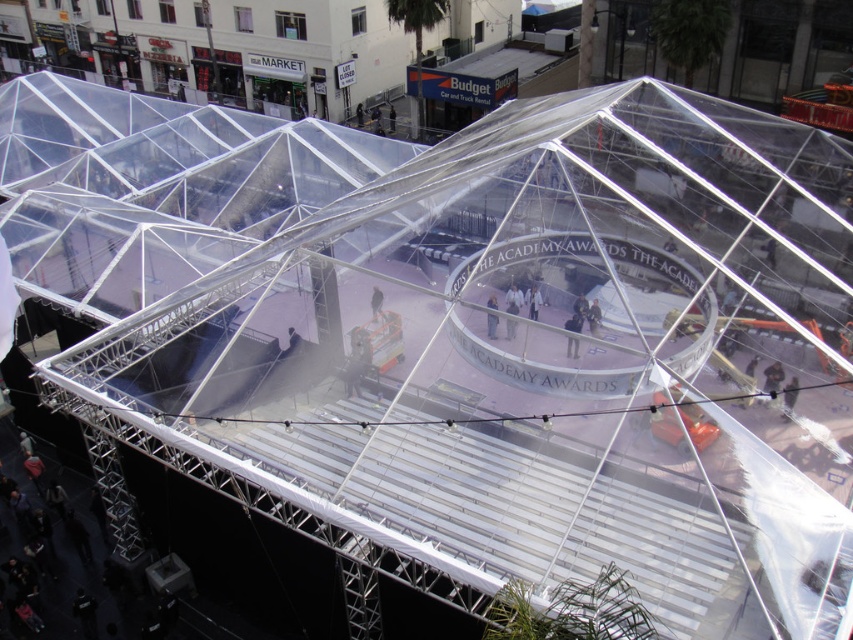
Question: Is dark gray fabric jacket at center in front of light blue denim jacket at center?

Choices:
 (A) yes
 (B) no

Answer: (A)

Question: Is light brown fabric pants at center thinner than dark gray fabric jacket at center?

Choices:
 (A) no
 (B) yes

Answer: (A)

Question: Which point appears closest to the camera in this image?

Choices:
 (A) (511, 305)
 (B) (569, 339)

Answer: (B)

Question: Does dark gray fabric jacket at center have a lesser width compared to light blue denim jacket at center?

Choices:
 (A) yes
 (B) no

Answer: (B)

Question: Which point is farther to the camera?

Choices:
 (A) (573, 342)
 (B) (519, 291)
 (C) (488, 300)

Answer: (B)

Question: Estimate the real-world distances between objects in this image. Which object is closer to the dark gray fabric jacket at center?

Choices:
 (A) light brown fabric pants at center
 (B) light blue denim jacket at center

Answer: (A)